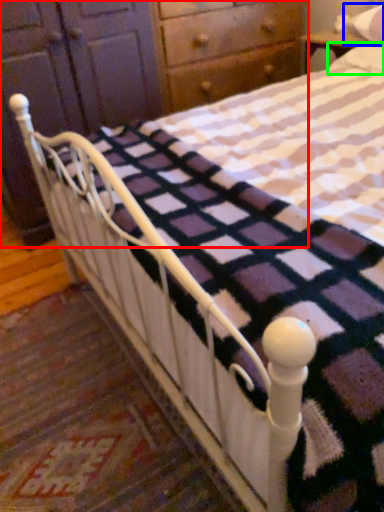
Question: Based on their relative distances, which object is farther from dresser (highlighted by a red box)? Choose from pillow (highlighted by a blue box) and pillow (highlighted by a green box).

Choices:
 (A) pillow
 (B) pillow

Answer: (A)